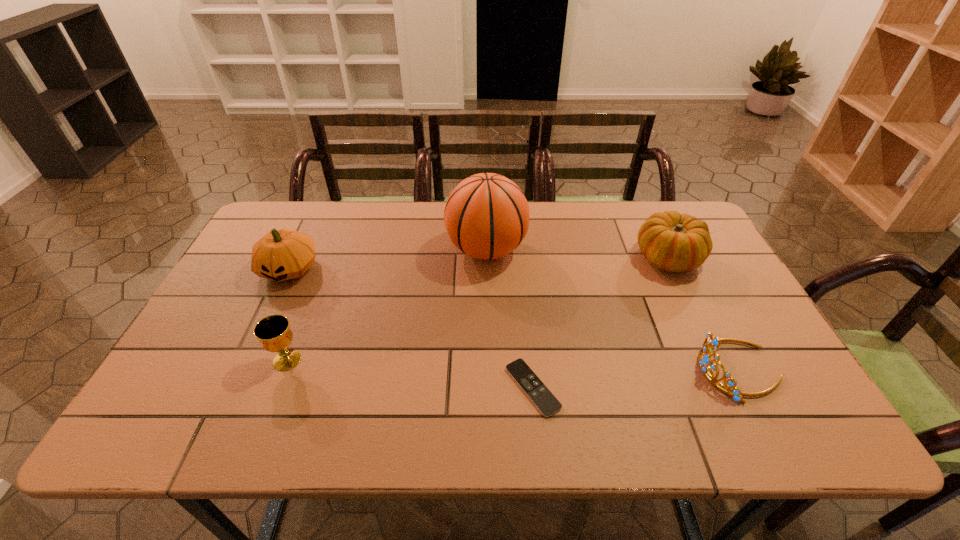
The image size is (960, 540). Find the location of `tiara that is at the right edge`. tiara that is at the right edge is located at coordinates (710, 342).

You are a GUI agent. You are given a task and a screenshot of the screen. Output one action in this format:
    pyautogui.click(x=<x>, y=<y>)
    Task: Click on the object that is at the far right corner
    The image size is (960, 540).
    Given the screenshot: What is the action you would take?
    pyautogui.click(x=672, y=242)

Locate an element on the screen. object at the near right corner is located at coordinates (710, 342).

Identify the location of vacant space at the far edge of the desktop. This screenshot has width=960, height=540. (613, 227).

The width and height of the screenshot is (960, 540). In order to click on free space at the near edge of the desktop in this screenshot , I will do `click(691, 435)`.

Identify the location of vacant region at the right edge of the desktop. (682, 272).

This screenshot has height=540, width=960. Find the location of `vacant space in between the chalice and the remote control`. vacant space in between the chalice and the remote control is located at coordinates (410, 374).

At what (x,y) coordinates should I click in order to perform the action: click on empty space that is in between the chalice and the remote control. Please return your answer as a coordinate pair (x, y). Looking at the image, I should click on (410, 374).

The width and height of the screenshot is (960, 540). What are the coordinates of `blank region between the right gourd and the basketball` in the screenshot? It's located at (578, 254).

Find the location of a particular element. The width and height of the screenshot is (960, 540). vacant space in between the tiara and the basketball is located at coordinates (612, 310).